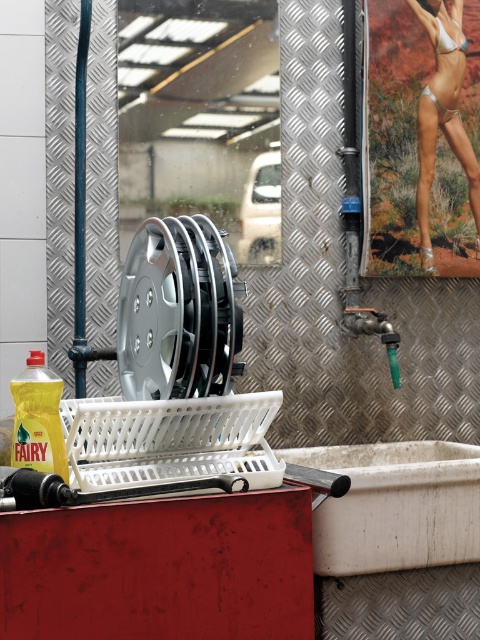
Question: Which object is closer to the camera taking this photo?

Choices:
 (A) silver metallic bikini at upper right
 (B) green plastic faucet at center right
 (C) white matte bikini at upper right
 (D) silver metallic tire at center

Answer: (D)

Question: Which of the following is the closest to the observer?

Choices:
 (A) silver metallic tire at center
 (B) silver metallic bikini at upper right
 (C) white matte bikini at upper right
 (D) green plastic faucet at center right

Answer: (A)

Question: Which point is farther from the camera taking this photo?

Choices:
 (A) (435, 54)
 (B) (391, 369)

Answer: (A)

Question: Can you confirm if silver metallic tire at center is smaller than silver metallic bikini at upper right?

Choices:
 (A) no
 (B) yes

Answer: (A)

Question: Can you confirm if green plastic faucet at center right is bigger than white matte bikini top at upper right?

Choices:
 (A) yes
 (B) no

Answer: (A)

Question: Does silver metallic tire at center lie in front of white matte bikini top at upper right?

Choices:
 (A) no
 (B) yes

Answer: (B)